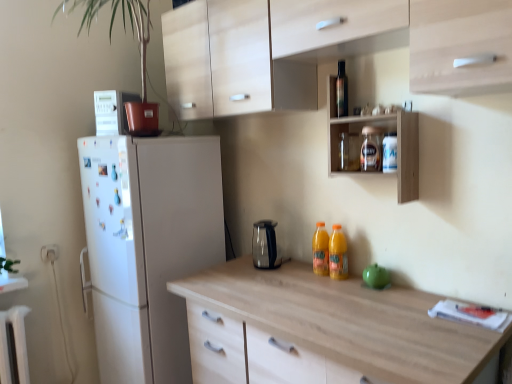
Question: From the image's perspective, is transparent glass jar at upper center, the third bottle positioned from the bottom, above white plastic electric outlet at lower left?

Choices:
 (A) yes
 (B) no

Answer: (A)

Question: Is white plastic electric outlet at lower left completely or partially inside transparent glass jar at upper center, the 2th bottle in the top-to-bottom sequence?

Choices:
 (A) no
 (B) yes

Answer: (A)

Question: Is transparent glass jar at upper center, the third bottle positioned from the bottom, positioned behind white plastic electric outlet at lower left?

Choices:
 (A) no
 (B) yes

Answer: (A)

Question: From the image's perspective, is transparent glass jar at upper center, the third bottle positioned from the bottom, located beneath white plastic electric outlet at lower left?

Choices:
 (A) yes
 (B) no

Answer: (B)

Question: Can you confirm if transparent glass jar at upper center, the third bottle positioned from the bottom, is taller than white plastic electric outlet at lower left?

Choices:
 (A) yes
 (B) no

Answer: (A)

Question: Is transparent glass jar at upper center, the 2th bottle in the top-to-bottom sequence, shorter than white plastic electric outlet at lower left?

Choices:
 (A) no
 (B) yes

Answer: (A)

Question: Is clear plastic bottle at upper right, which appears as the second bottle when ordered from the bottom, further to the viewer compared to wooden shelf at upper center?

Choices:
 (A) yes
 (B) no

Answer: (A)

Question: Is clear plastic bottle at upper right, which appears as the second bottle when ordered from the bottom, with wooden shelf at upper center?

Choices:
 (A) yes
 (B) no

Answer: (B)

Question: Does clear plastic bottle at upper right, the 3th bottle in the top-to-bottom sequence, turn towards wooden shelf at upper center?

Choices:
 (A) yes
 (B) no

Answer: (A)

Question: From a real-world perspective, is clear plastic bottle at upper right, the 3th bottle in the top-to-bottom sequence, positioned over wooden shelf at upper center based on gravity?

Choices:
 (A) no
 (B) yes

Answer: (A)

Question: From the image's perspective, does clear plastic bottle at upper right, which appears as the second bottle when ordered from the bottom, appear lower than wooden shelf at upper center?

Choices:
 (A) yes
 (B) no

Answer: (A)

Question: Does clear plastic bottle at upper right, which appears as the second bottle when ordered from the bottom, have a larger size compared to wooden shelf at upper center?

Choices:
 (A) yes
 (B) no

Answer: (B)

Question: Considering the relative sizes of white plastic electric outlet at lower left and clear plastic bottle at upper right, the 3th bottle in the top-to-bottom sequence, in the image provided, is white plastic electric outlet at lower left wider than clear plastic bottle at upper right, the 3th bottle in the top-to-bottom sequence,?

Choices:
 (A) yes
 (B) no

Answer: (B)